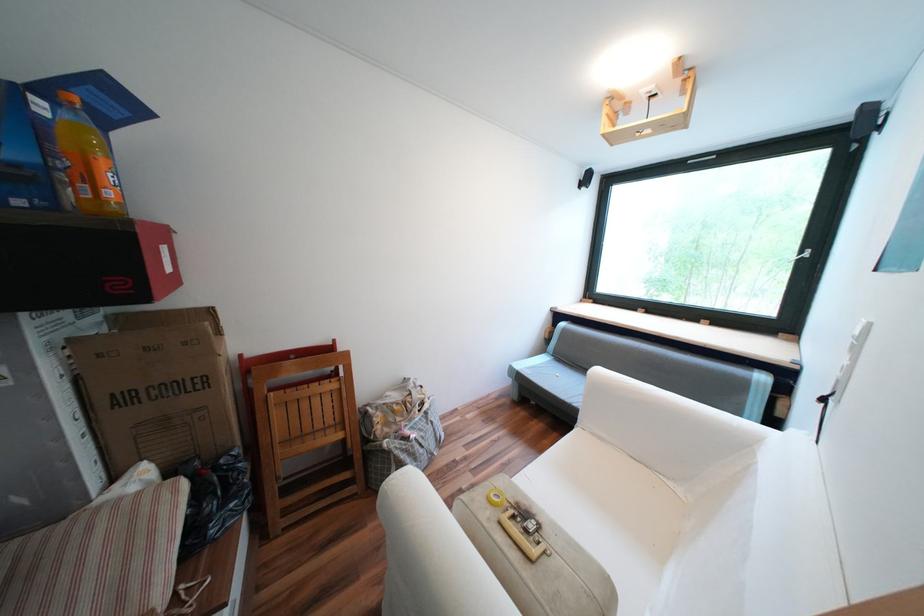
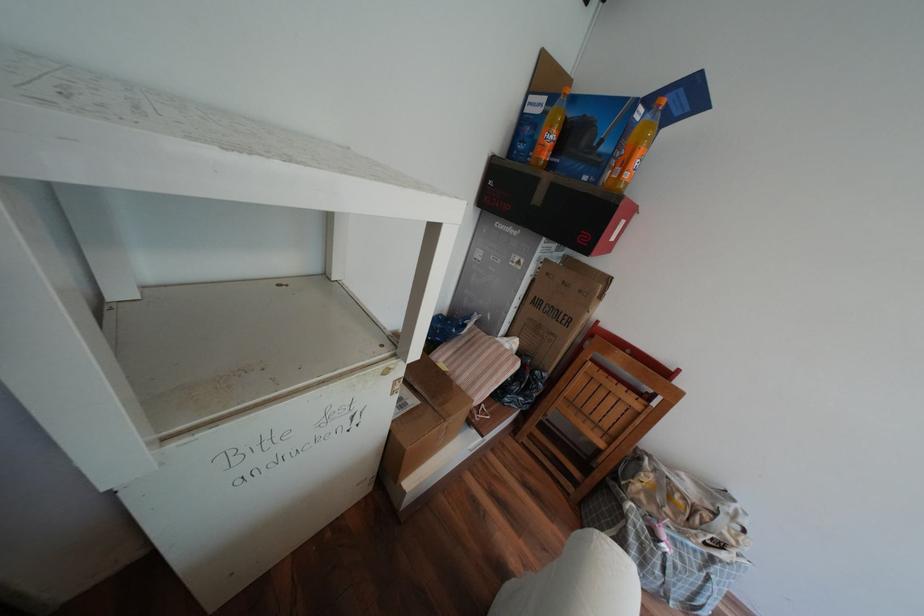
Locate, in the second image, the point that corresponds to (x=53, y=92) in the first image.

(659, 100)